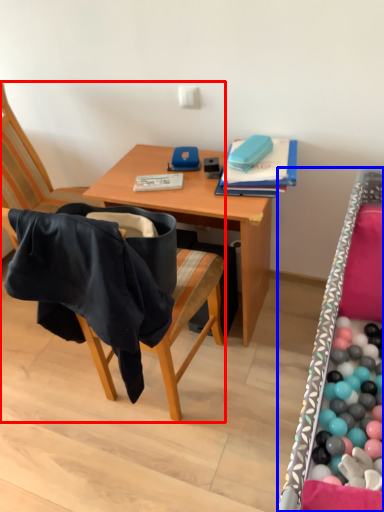
Question: Which object appears farthest to the camera in this image, chair (highlighted by a red box) or bed frame (highlighted by a blue box)?

Choices:
 (A) chair
 (B) bed frame

Answer: (A)